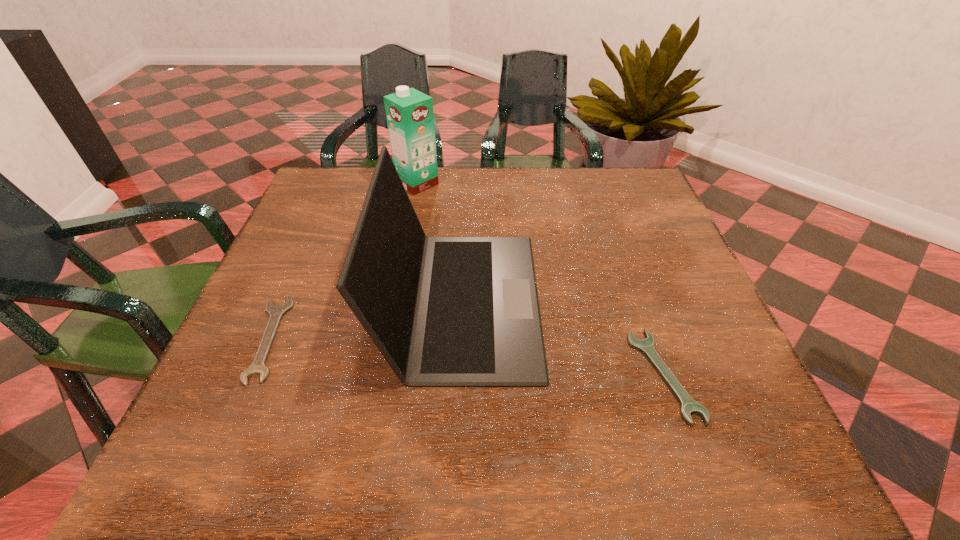
Where is `unoccupied position between the rightmost object and the laptop`? unoccupied position between the rightmost object and the laptop is located at coordinates (563, 338).

This screenshot has width=960, height=540. I want to click on free area in between the laptop and the rightmost object, so click(x=563, y=338).

Locate an element on the screen. The height and width of the screenshot is (540, 960). free space that is in between the leftmost object and the farthest object is located at coordinates (343, 261).

Find the location of a particular element. free space between the carton and the left wrench is located at coordinates (343, 261).

I want to click on object that is the second closest to the laptop, so click(x=276, y=312).

Where is `the third closest object relative to the laptop`? This screenshot has width=960, height=540. the third closest object relative to the laptop is located at coordinates (410, 118).

Identify the location of vacant area in the image that satisfies the following two spatial constraints: 1. on the screen of the laptop; 2. on the right side of the rightmost object. (458, 375).

The width and height of the screenshot is (960, 540). In order to click on vacant space that satisfies the following two spatial constraints: 1. on the screen of the laptop; 2. on the front side of the left wrench in this screenshot , I will do `click(460, 339)`.

In order to click on free space that satisfies the following two spatial constraints: 1. on the screen of the laptop; 2. on the front side of the leftmost object in this screenshot , I will do `click(460, 339)`.

Image resolution: width=960 pixels, height=540 pixels. Find the location of `free location that satisfies the following two spatial constraints: 1. on the front side of the left wrench; 2. on the left side of the rightmost object`. free location that satisfies the following two spatial constraints: 1. on the front side of the left wrench; 2. on the left side of the rightmost object is located at coordinates (252, 375).